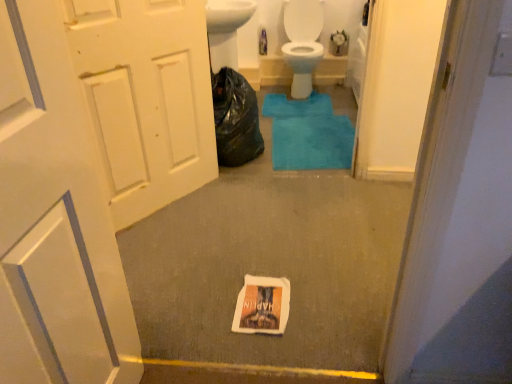
This screenshot has height=384, width=512. Identify the location of free space in front of white paper flyer at center. (270, 342).